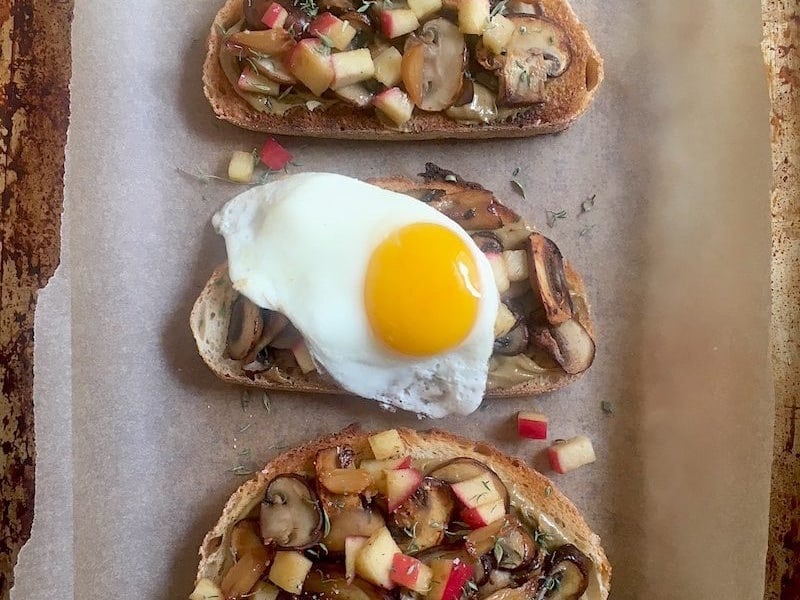
Where is `baking tray`? The image size is (800, 600). baking tray is located at coordinates (786, 172).